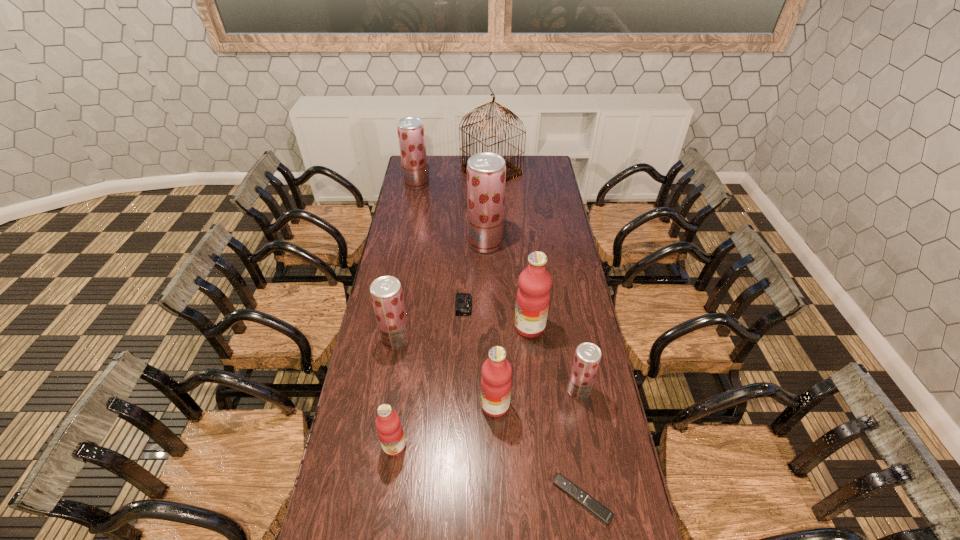
The image size is (960, 540). I want to click on strawberry fruit juice that is the closest one to the second nearest strawberry fruit juice, so click(x=486, y=172).

Image resolution: width=960 pixels, height=540 pixels. In order to click on strawberry fruit juice that is the second closest to the second smallest strawberry fruit juice in this screenshot , I will do `click(587, 357)`.

Image resolution: width=960 pixels, height=540 pixels. In order to click on the third closest pink fruit juice relative to the nearest object in this screenshot , I will do `click(533, 296)`.

At what (x,y) coordinates should I click in order to perform the action: click on pink fruit juice that is the third nearest to the farthest fruit juice. Please return your answer as a coordinate pair (x, y). The height and width of the screenshot is (540, 960). Looking at the image, I should click on (389, 428).

This screenshot has height=540, width=960. What are the coordinates of `blank area in the image that satisfies the following two spatial constraints: 1. on the back side of the tallest fruit juice; 2. on the right side of the third farthest strawberry fruit juice` in the screenshot? It's located at (413, 243).

Where is `free spot that satisfies the following two spatial constraints: 1. on the front side of the third farthest strawberry fruit juice; 2. on the right side of the nearest object`? This screenshot has height=540, width=960. free spot that satisfies the following two spatial constraints: 1. on the front side of the third farthest strawberry fruit juice; 2. on the right side of the nearest object is located at coordinates (369, 500).

Where is `free space that satisfies the following two spatial constraints: 1. on the front side of the third biggest strawberry fruit juice; 2. on the right side of the rightmost fruit juice`? This screenshot has height=540, width=960. free space that satisfies the following two spatial constraints: 1. on the front side of the third biggest strawberry fruit juice; 2. on the right side of the rightmost fruit juice is located at coordinates click(x=388, y=390).

You are a GUI agent. You are given a task and a screenshot of the screen. Output one action in this format:
    pyautogui.click(x=<x>, y=<y>)
    Task: Click on the vacant space that satisfies the following two spatial constraints: 1. on the label of the second nearest object; 2. on the left side of the shortest object
    This screenshot has width=960, height=540.
    Given the screenshot: What is the action you would take?
    pyautogui.click(x=387, y=500)

Identify the location of free region that satisfies the following two spatial constraints: 1. on the front side of the farthest fruit juice; 2. on the right side of the third biggest strawberry fruit juice. The height and width of the screenshot is (540, 960). (388, 340).